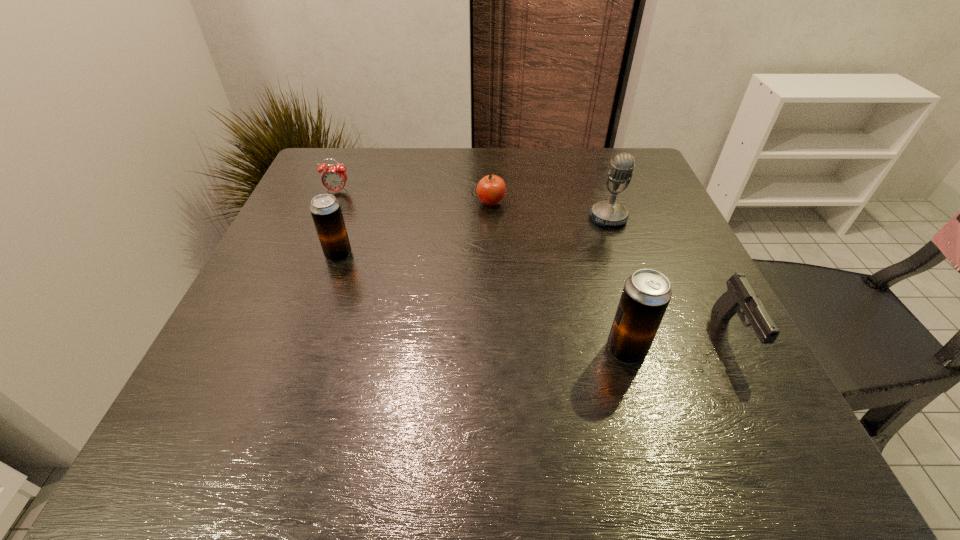
At what (x,y) coordinates should I click in order to perform the action: click on free space at the far right corner of the desktop. Please return your answer as a coordinate pair (x, y). This screenshot has height=540, width=960. Looking at the image, I should click on (589, 170).

What are the coordinates of `free region at the near right corner of the desktop` in the screenshot? It's located at (725, 377).

This screenshot has width=960, height=540. I want to click on vacant area that lies between the farthest object and the microphone, so click(473, 205).

In order to click on unoccupied area between the microphone and the rightmost object in this screenshot , I will do `click(671, 277)`.

The width and height of the screenshot is (960, 540). I want to click on vacant space that's between the taller beer can and the microphone, so (617, 284).

Locate an element on the screen. unoccupied area between the microphone and the nearer beer can is located at coordinates (617, 284).

The width and height of the screenshot is (960, 540). I want to click on free area in between the third object from left to right and the nearer beer can, so [559, 276].

In order to click on empty space between the alarm clock and the nearer beer can in this screenshot , I will do `click(482, 271)`.

Where is `blank region between the apple and the pistol`? Image resolution: width=960 pixels, height=540 pixels. blank region between the apple and the pistol is located at coordinates (612, 269).

Where is `vacant area that lies between the microphone and the pistol`? vacant area that lies between the microphone and the pistol is located at coordinates (671, 277).